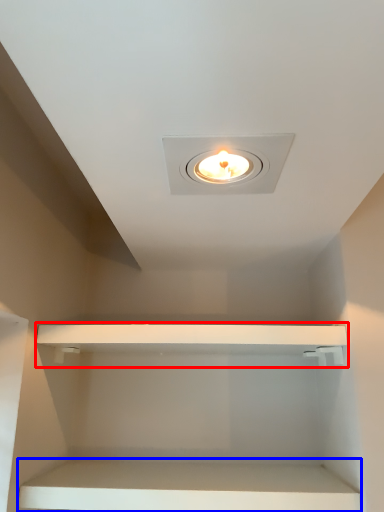
Question: Which object is closer to the camera taking this photo, cabinet (highlighted by a red box) or cabinet (highlighted by a blue box)?

Choices:
 (A) cabinet
 (B) cabinet

Answer: (B)